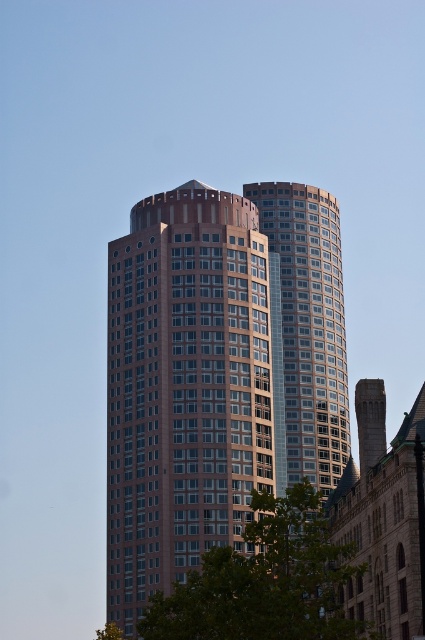
Question: Can you confirm if shiny glass building at right is positioned above green leafy tree at lower left?

Choices:
 (A) yes
 (B) no

Answer: (A)

Question: Which object is closer to the camera taking this photo?

Choices:
 (A) shiny glass building at right
 (B) green leafy tree at lower center
 (C) green leafy tree at lower left
 (D) pink glassy building at center

Answer: (B)

Question: Is shiny glass building at right wider than green leafy tree at lower center?

Choices:
 (A) yes
 (B) no

Answer: (B)

Question: Is green leafy tree at lower center to the right of green leafy tree at lower left from the viewer's perspective?

Choices:
 (A) yes
 (B) no

Answer: (A)

Question: Which point is farther to the camera?

Choices:
 (A) (323, 557)
 (B) (337, 236)
 (C) (107, 625)

Answer: (B)

Question: Which is farther from the pink glassy building at center?

Choices:
 (A) green leafy tree at lower center
 (B) green leafy tree at lower left

Answer: (A)